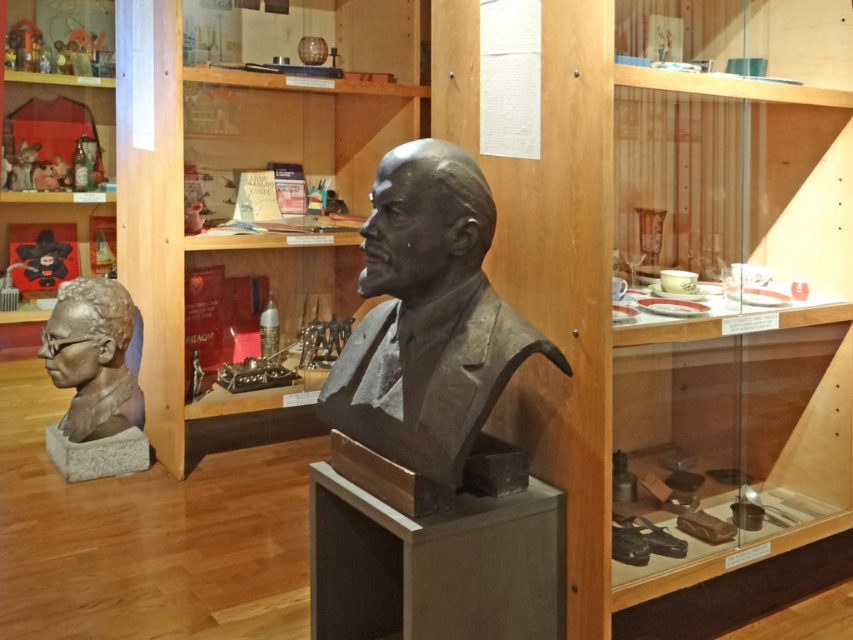
Question: Among these points, which one is nearest to the camera?

Choices:
 (A) (482, 328)
 (B) (119, 154)

Answer: (A)

Question: Which point appears closest to the camera in this image?

Choices:
 (A) (114, 368)
 (B) (288, 339)

Answer: (A)

Question: Which point is closer to the camera?

Choices:
 (A) (125, 349)
 (B) (418, 172)

Answer: (B)

Question: Does wooden bookshelf at center have a lesser width compared to satin silver bust at center?

Choices:
 (A) yes
 (B) no

Answer: (B)

Question: Is wooden bookshelf at center to the left of satin silver bust at center from the viewer's perspective?

Choices:
 (A) yes
 (B) no

Answer: (B)

Question: Does wooden bookshelf at center come in front of satin silver bust at center?

Choices:
 (A) no
 (B) yes

Answer: (B)